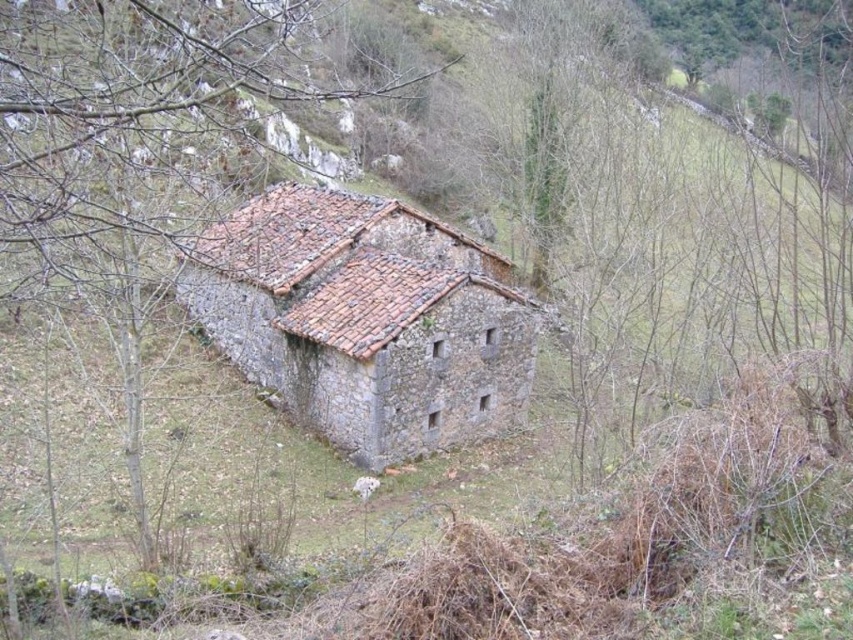
You are standing at the entrance of the rustic stone building and want to plant a new tree exactly 0.1 meters to the north of the brown bark tree at center. Given the coordinates provided, where should you place the new tree?

The brown bark tree at center is located at coordinates point (131, 144). To plant the new tree 0.1 meters north, you would place it at point (131, 144) plus 0.1 meters north. However, the coordinate system used here might require adjusting for direction. Assuming the y coordinate increases northward, the new position would be approximately (216, 144).

You are standing in front of the rustic stone barn at center and want to find the brown bark tree at center. Which direction should you look?

The brown bark tree at center is to the left of rustic stone barn at center, so you should look to your left to find it.